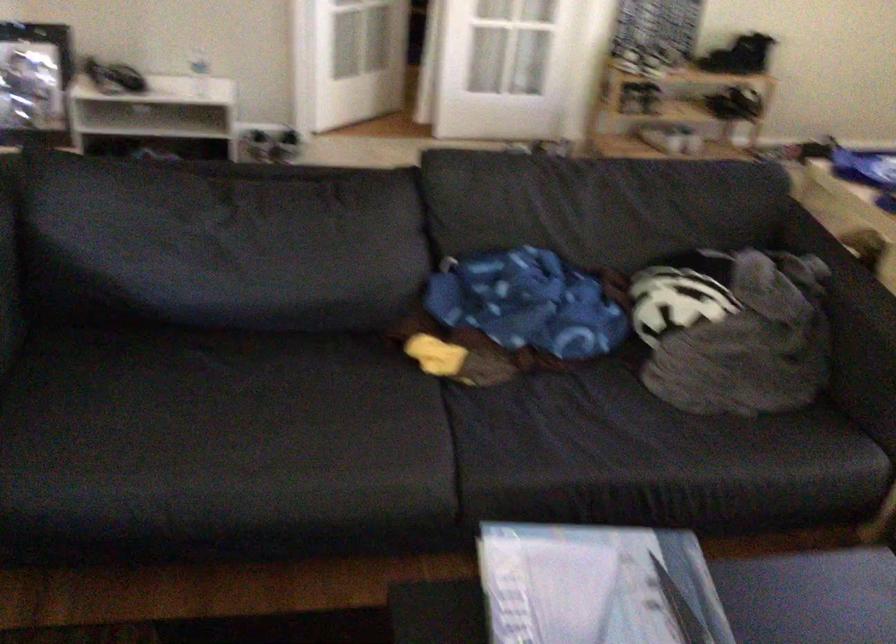
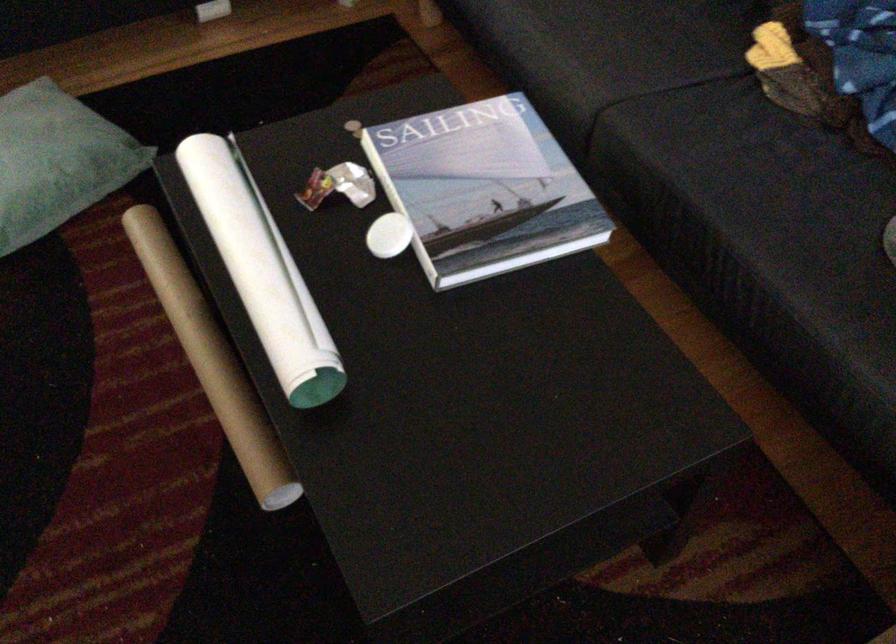
Where in the second image is the point corresponding to [483,353] from the first image?

(808, 77)